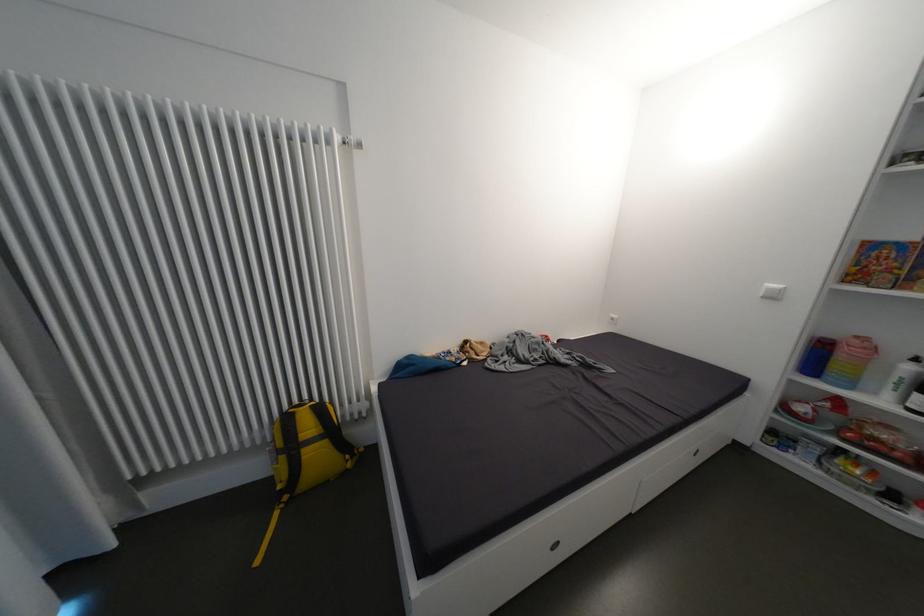
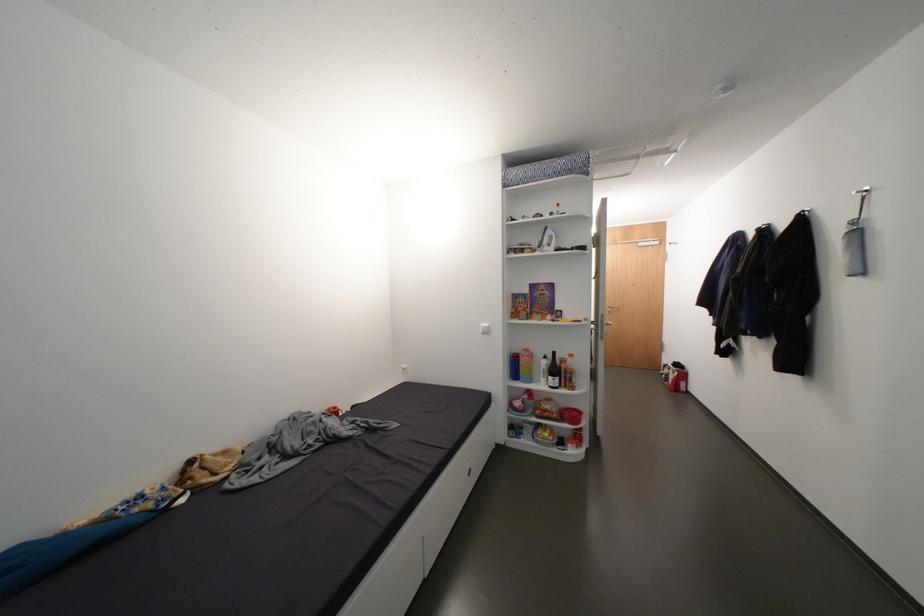
Find the pixel in the second image that matches pixel 451 355 in the first image.

(131, 508)